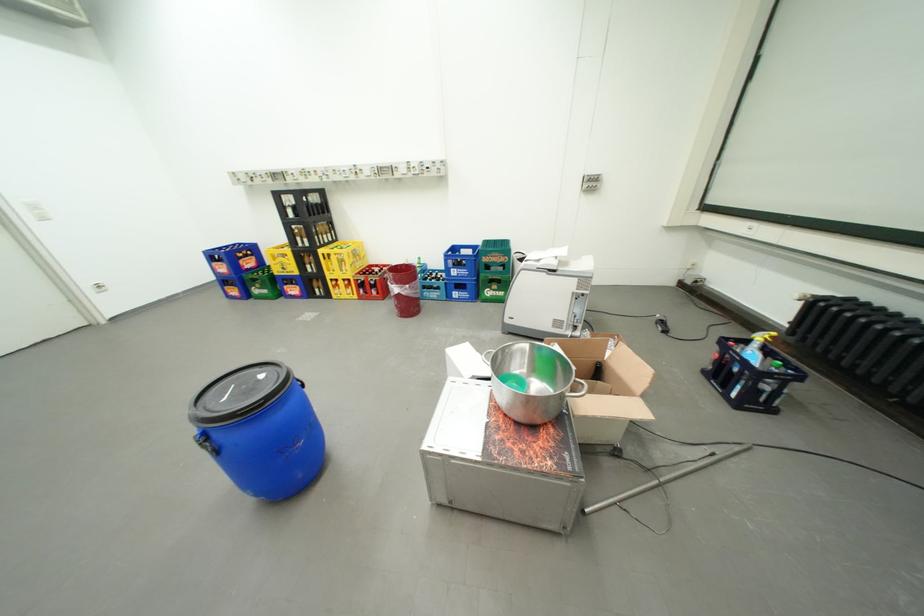
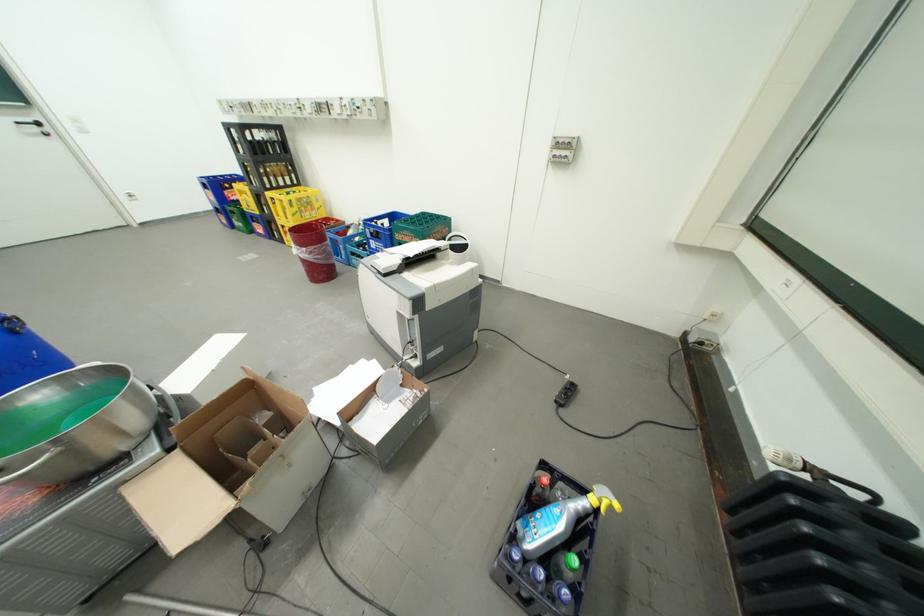
Find the pixel in the second image that matches (x=418, y=286) in the first image.

(314, 249)